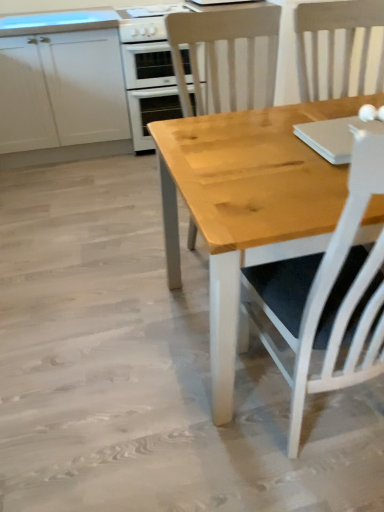
You are a GUI agent. You are given a task and a screenshot of the screen. Output one action in this format:
    pyautogui.click(x=<x>, y=<y>)
    Task: Click on the vacant area that is in front of wooden chair at center
    The height and width of the screenshot is (512, 384).
    Given the screenshot: What is the action you would take?
    pyautogui.click(x=189, y=340)